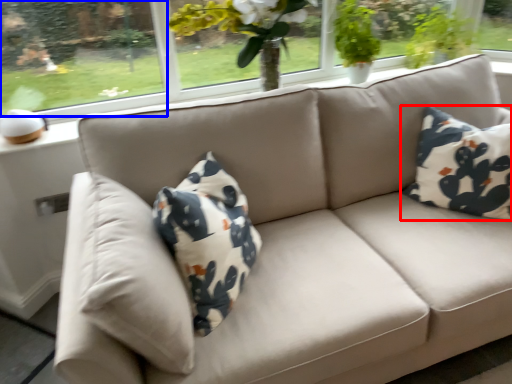
Question: Which object is closer to the camera taking this photo, pillow (highlighted by a red box) or window screen (highlighted by a blue box)?

Choices:
 (A) pillow
 (B) window screen

Answer: (A)